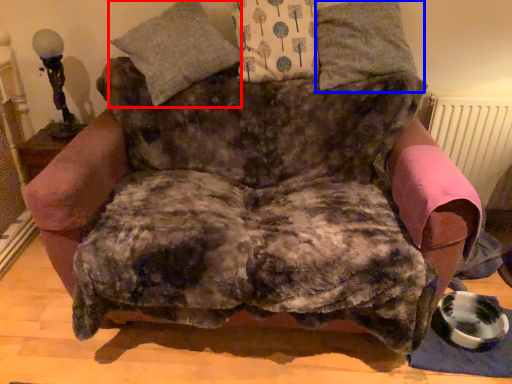
Question: Which point is closer to the camera, pillow (highlighted by a red box) or pillow (highlighted by a blue box)?

Choices:
 (A) pillow
 (B) pillow

Answer: (A)